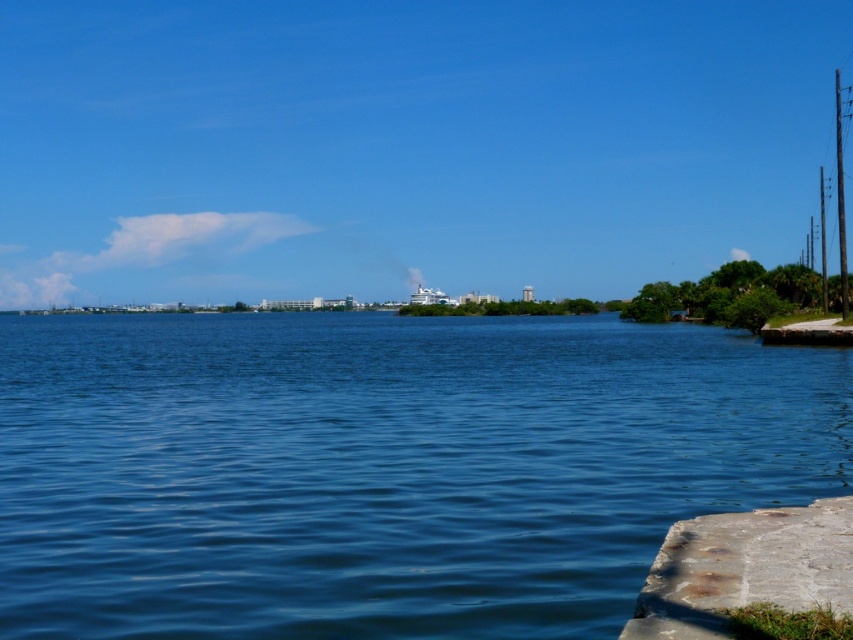
Question: Which point appears closest to the camera in this image?

Choices:
 (A) (697, 609)
 (B) (426, 305)

Answer: (A)

Question: Can you confirm if blue water at center is thinner than concrete at lower right?

Choices:
 (A) yes
 (B) no

Answer: (B)

Question: Is blue water at center smaller than concrete at lower right?

Choices:
 (A) yes
 (B) no

Answer: (B)

Question: Does concrete at lower right appear under white glossy cruise ship at center?

Choices:
 (A) no
 (B) yes

Answer: (B)

Question: Among these points, which one is nearest to the camera?

Choices:
 (A) (732, 536)
 (B) (433, 298)

Answer: (A)

Question: Which point is closer to the camera?

Choices:
 (A) (699, 632)
 (B) (48, 484)
 (C) (447, 301)

Answer: (A)